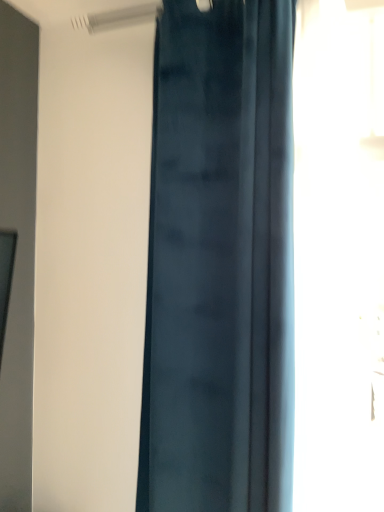
Question: Are transparent glass window at right and satin blue curtain at center far apart?

Choices:
 (A) no
 (B) yes

Answer: (A)

Question: Does transparent glass window at right have a larger size compared to satin blue curtain at center?

Choices:
 (A) yes
 (B) no

Answer: (B)

Question: From a real-world perspective, does transparent glass window at right sit lower than satin blue curtain at center?

Choices:
 (A) no
 (B) yes

Answer: (A)

Question: Is satin blue curtain at center inside transparent glass window at right?

Choices:
 (A) no
 (B) yes

Answer: (A)

Question: From a real-world perspective, is transparent glass window at right on top of satin blue curtain at center?

Choices:
 (A) yes
 (B) no

Answer: (A)

Question: Considering the relative sizes of transparent glass window at right and satin blue curtain at center in the image provided, is transparent glass window at right wider than satin blue curtain at center?

Choices:
 (A) yes
 (B) no

Answer: (A)

Question: Does satin blue curtain at center have a larger size compared to transparent glass window at right?

Choices:
 (A) yes
 (B) no

Answer: (A)

Question: From the image's perspective, is satin blue curtain at center below transparent glass window at right?

Choices:
 (A) no
 (B) yes

Answer: (B)

Question: Is the position of satin blue curtain at center more distant than that of transparent glass window at right?

Choices:
 (A) yes
 (B) no

Answer: (A)

Question: Is satin blue curtain at center oriented away from transparent glass window at right?

Choices:
 (A) no
 (B) yes

Answer: (A)

Question: Is satin blue curtain at center in front of transparent glass window at right?

Choices:
 (A) yes
 (B) no

Answer: (B)

Question: From the image's perspective, would you say satin blue curtain at center is positioned over transparent glass window at right?

Choices:
 (A) yes
 (B) no

Answer: (B)

Question: Is point (327, 493) closer or farther from the camera than point (220, 437)?

Choices:
 (A) closer
 (B) farther

Answer: (A)